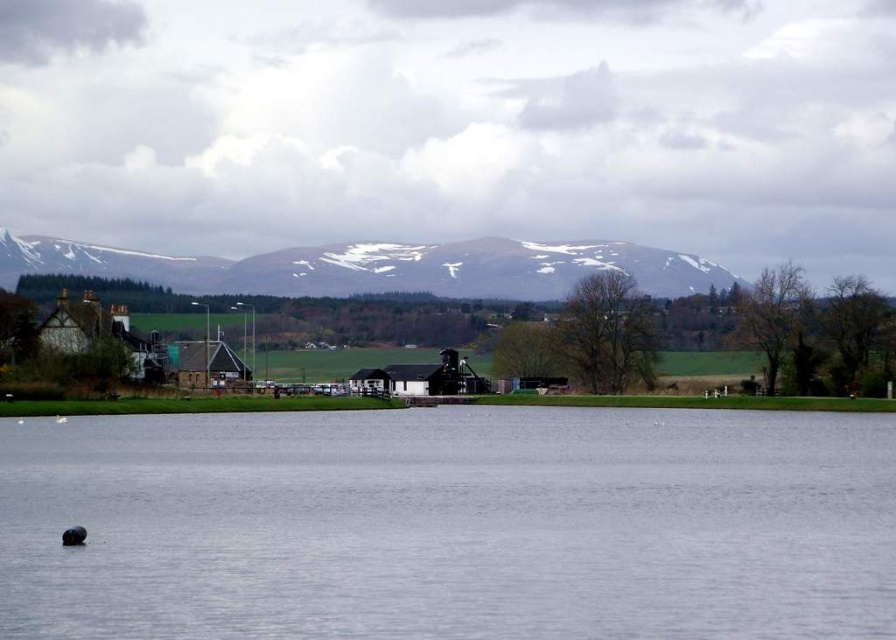
Question: Which of the following is the farthest from the observer?

Choices:
 (A) clear water at center
 (B) snowy rock mountain at upper center

Answer: (B)

Question: Is clear water at center smaller than snowy rock mountain at upper center?

Choices:
 (A) no
 (B) yes

Answer: (B)

Question: Is clear water at center to the right of snowy rock mountain at upper center from the viewer's perspective?

Choices:
 (A) yes
 (B) no

Answer: (A)

Question: Is clear water at center bigger than snowy rock mountain at upper center?

Choices:
 (A) no
 (B) yes

Answer: (A)